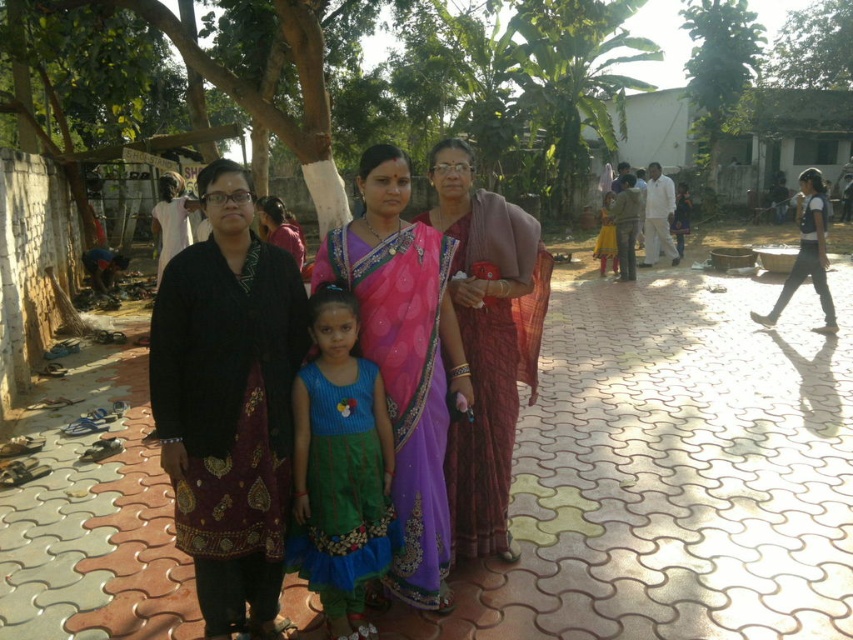
In the scene shown: Does brown woven sari at center have a lesser width compared to blue textured dress at center?

In fact, brown woven sari at center might be wider than blue textured dress at center.

Is brown woven sari at center smaller than blue textured dress at center?

No, brown woven sari at center is not smaller than blue textured dress at center.

Image resolution: width=853 pixels, height=640 pixels. In order to click on brown woven sari at center in this screenshot , I will do `click(486, 340)`.

At what (x,y) coordinates should I click in order to perform the action: click on brown woven sari at center. Please return your answer as a coordinate pair (x, y). Looking at the image, I should click on (486, 340).

Which is more to the right, matte pink sari at center or green leafy tree at upper center?

From the viewer's perspective, green leafy tree at upper center appears more on the right side.

How much distance is there between matte pink sari at center and green leafy tree at upper center?

matte pink sari at center and green leafy tree at upper center are 62.11 feet apart from each other.

What do you see at coordinates (440, 360) in the screenshot?
I see `matte pink sari at center` at bounding box center [440, 360].

The image size is (853, 640). Find the location of `matte pink sari at center`. matte pink sari at center is located at coordinates (440, 360).

Looking at this image, does green leafy tree at upper right have a greater width compared to yellow cotton dress at center?

Indeed, green leafy tree at upper right has a greater width compared to yellow cotton dress at center.

Is point (850, 88) closer to viewer compared to point (628, 246)?

That is False.

Identify the location of green leafy tree at upper right. (813, 48).